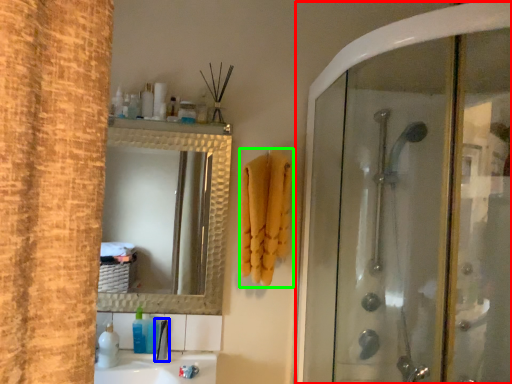
Question: Which object is positioned closest to screen door (highlighted by a red box)? Select from faucet (highlighted by a blue box) and bath towel (highlighted by a green box).

Choices:
 (A) faucet
 (B) bath towel

Answer: (B)